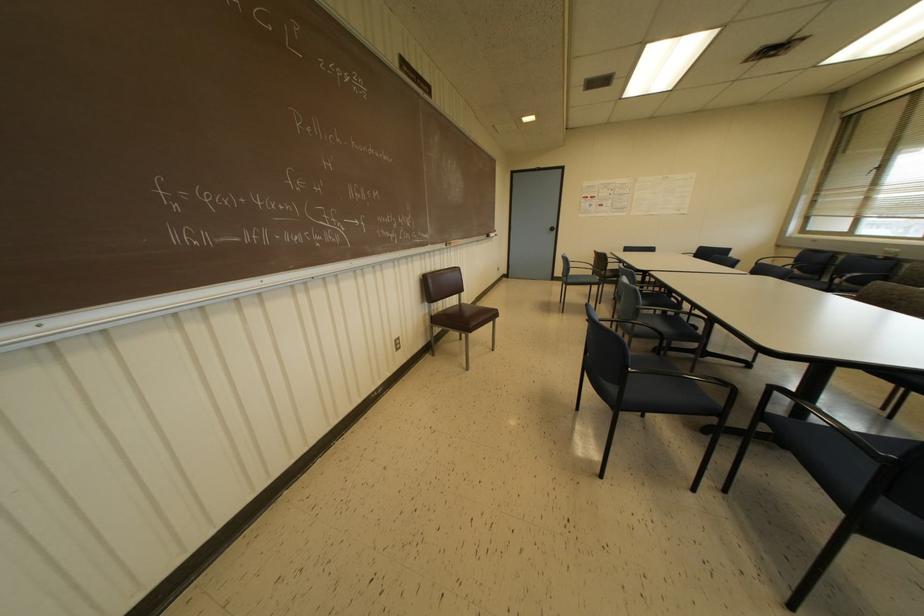
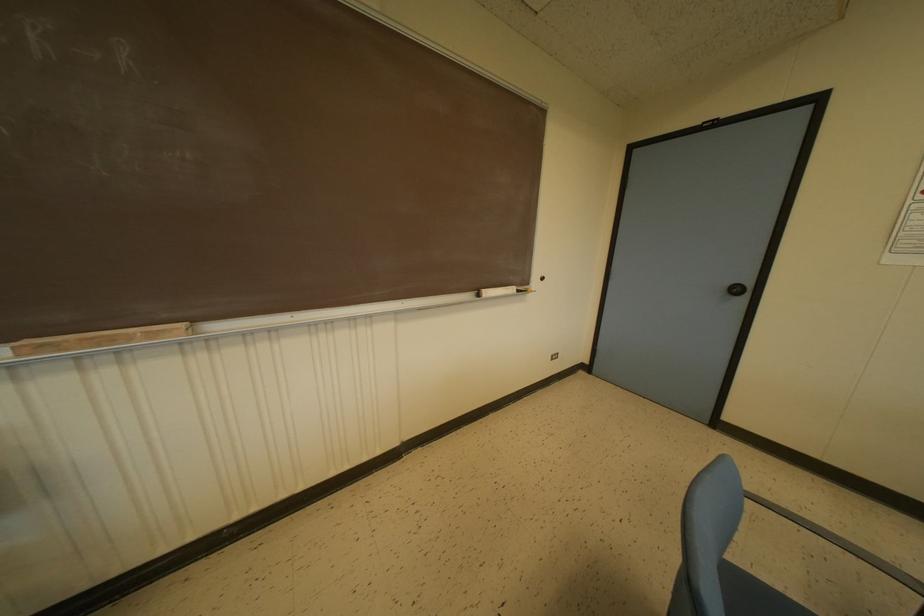
In the second image, find the point that corresponds to pixel 491 233 in the first image.

(487, 292)